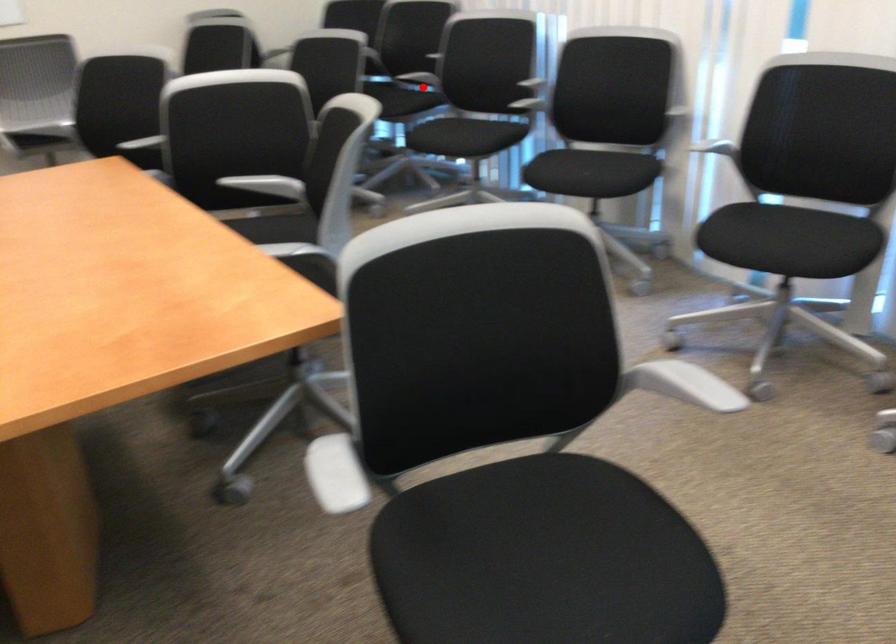
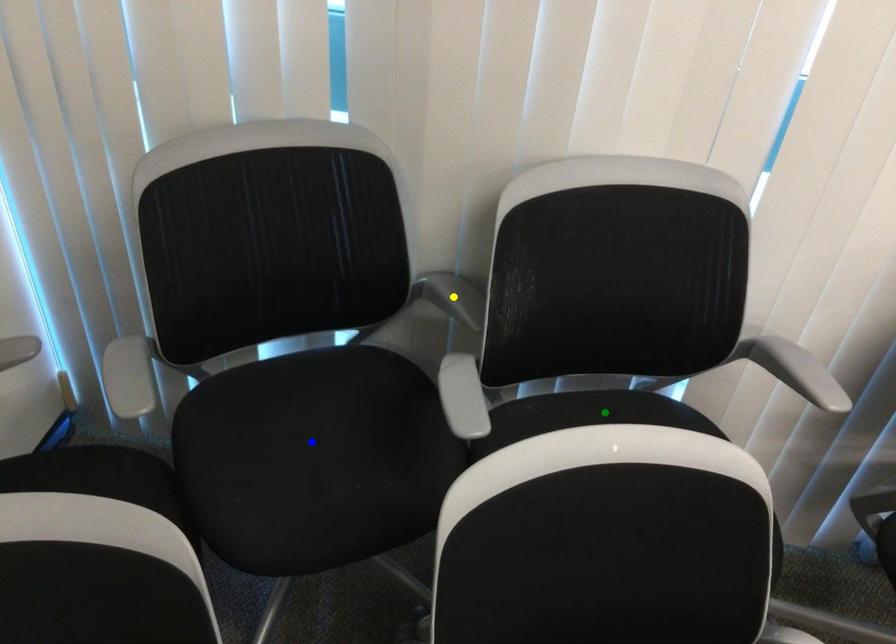
Question: I am providing you with two images of the same scene from different viewpoints. A red point is marked on the first image. You are given multiple points on the second image. In image 2, which mark is for the same physical point as the one in image 1?

Choices:
 (A) blue point
 (B) yellow point
 (C) green point

Answer: (C)